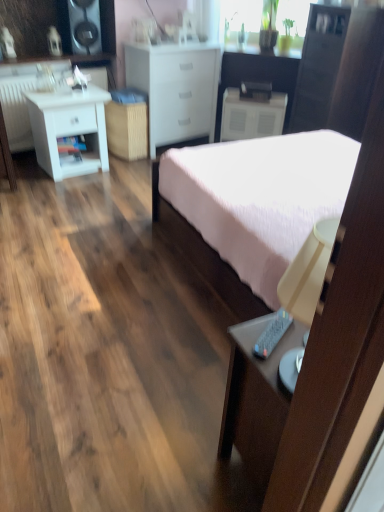
Question: From the image's perspective, is white matte nightstand at left, the first nightstand from the left, on white matte nightstand at center, the 1th nightstand in the right-to-left sequence?

Choices:
 (A) no
 (B) yes

Answer: (A)

Question: Is white matte nightstand at left, acting as the first nightstand starting from the front, in front of white matte nightstand at center, which is counted as the 2th nightstand, starting from the front?

Choices:
 (A) yes
 (B) no

Answer: (A)

Question: From the image's perspective, would you say white matte nightstand at left, acting as the first nightstand starting from the front, is shown under white matte nightstand at center, acting as the 1th nightstand starting from the back?

Choices:
 (A) yes
 (B) no

Answer: (A)

Question: Is white matte nightstand at left, acting as the first nightstand starting from the front, facing towards white matte nightstand at center, the 1th nightstand in the right-to-left sequence?

Choices:
 (A) yes
 (B) no

Answer: (B)

Question: Is white matte nightstand at left, acting as the first nightstand starting from the front, at the left side of white matte nightstand at center, which is counted as the 2th nightstand, starting from the front?

Choices:
 (A) yes
 (B) no

Answer: (A)

Question: Can you confirm if white matte nightstand at left, the first nightstand from the left, is wider than white matte nightstand at center, the 1th nightstand in the right-to-left sequence?

Choices:
 (A) yes
 (B) no

Answer: (A)

Question: Considering the relative sizes of pink fabric bed at center and white matte nightstand at center, the 1th nightstand in the right-to-left sequence, in the image provided, is pink fabric bed at center shorter than white matte nightstand at center, the 1th nightstand in the right-to-left sequence,?

Choices:
 (A) no
 (B) yes

Answer: (A)

Question: Does pink fabric bed at center have a larger size compared to white matte nightstand at center, which is counted as the 2th nightstand, starting from the front?

Choices:
 (A) no
 (B) yes

Answer: (B)

Question: Does pink fabric bed at center come behind white matte nightstand at center, which is counted as the 2th nightstand, starting from the front?

Choices:
 (A) yes
 (B) no

Answer: (B)

Question: From the image's perspective, does pink fabric bed at center appear lower than white matte nightstand at center, the 1th nightstand in the right-to-left sequence?

Choices:
 (A) no
 (B) yes

Answer: (B)

Question: Is pink fabric bed at center with white matte nightstand at center, which is counted as the 2th nightstand, starting from the front?

Choices:
 (A) no
 (B) yes

Answer: (A)

Question: Is pink fabric bed at center positioned with its back to white matte nightstand at center, which is counted as the 2th nightstand, starting from the front?

Choices:
 (A) no
 (B) yes

Answer: (A)

Question: Considering the relative sizes of white matte chest of drawers at center and pink fabric bed at center in the image provided, is white matte chest of drawers at center smaller than pink fabric bed at center?

Choices:
 (A) yes
 (B) no

Answer: (A)